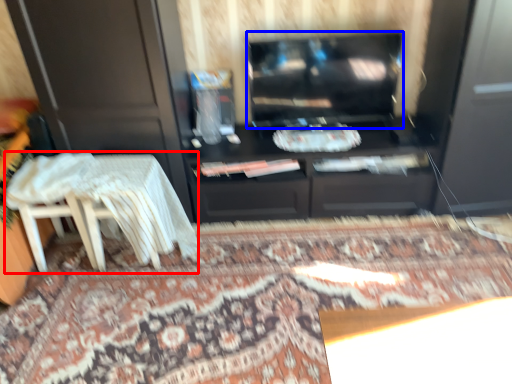
Question: Which of the following is the farthest to the observer, table (highlighted by a red box) or television (highlighted by a blue box)?

Choices:
 (A) table
 (B) television

Answer: (B)